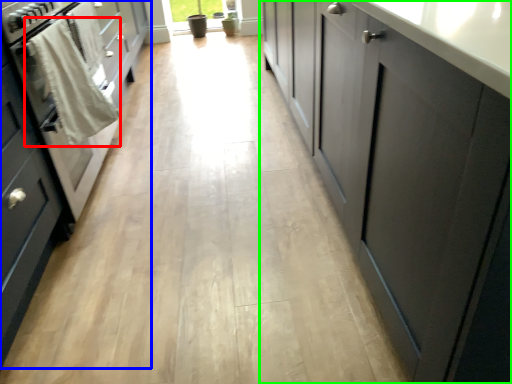
Question: Which object is positioned closest to laundry (highlighted by a red box)? Select from cabinetry (highlighted by a blue box) and cabinetry (highlighted by a green box).

Choices:
 (A) cabinetry
 (B) cabinetry

Answer: (A)